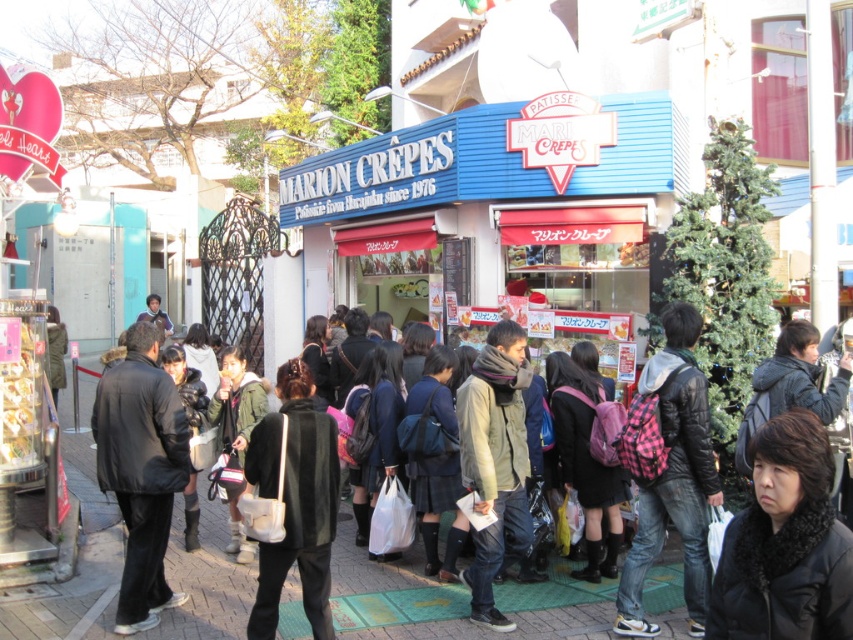
Measure the distance between black leather jacket at left and camera.

5.69 meters

Looking at this image, is black leather jacket at left bigger than black matte jacket at center?

Yes.

Locate an element on the screen. This screenshot has width=853, height=640. black leather jacket at left is located at coordinates (141, 470).

Identify the location of dark gray jacket at center. This screenshot has height=640, width=853. (207, 593).

Identify the location of dark gray jacket at center. This screenshot has height=640, width=853. pos(207,593).

Is point (589, 600) positioned in front of point (322, 502)?

No, it is not.

Image resolution: width=853 pixels, height=640 pixels. I want to click on dark gray jacket at center, so click(x=207, y=593).